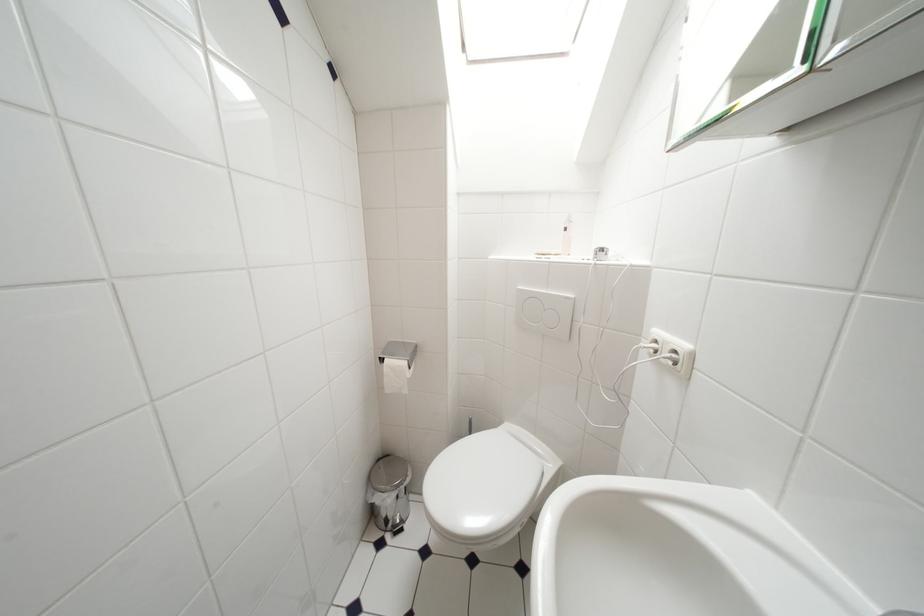
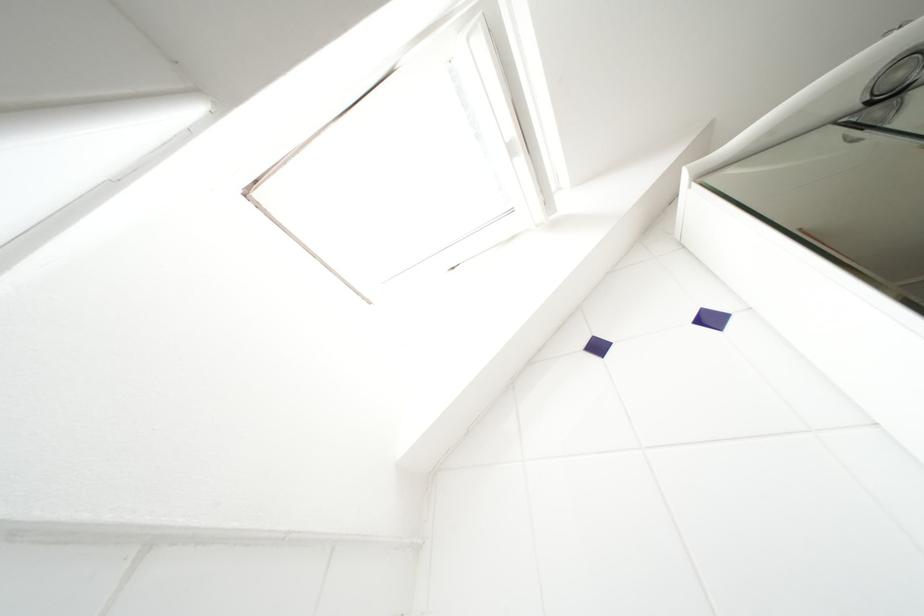
How did the camera likely rotate?

The camera's rotation is toward right-up.